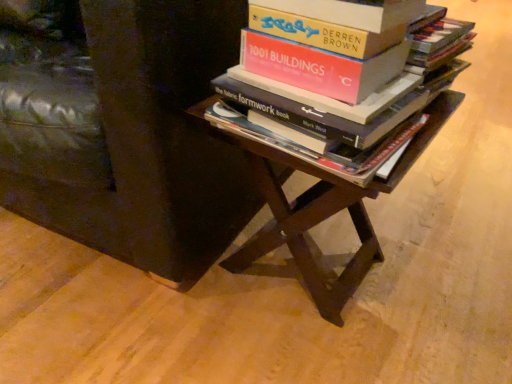
Question: Is hardcover book at center facing towards brown wooden table at center?

Choices:
 (A) yes
 (B) no

Answer: (B)

Question: Considering the relative sizes of hardcover book at center and brown wooden table at center in the image provided, is hardcover book at center smaller than brown wooden table at center?

Choices:
 (A) yes
 (B) no

Answer: (A)

Question: From the image's perspective, is hardcover book at center below brown wooden table at center?

Choices:
 (A) no
 (B) yes

Answer: (A)

Question: Does hardcover book at center lie in front of brown wooden table at center?

Choices:
 (A) yes
 (B) no

Answer: (A)

Question: Would you say hardcover book at center is a long distance from brown wooden table at center?

Choices:
 (A) yes
 (B) no

Answer: (B)

Question: Is brown wooden table at center at the back of hardcover book at center?

Choices:
 (A) no
 (B) yes

Answer: (A)

Question: Is brown wooden table at center turned away from wooden side table at center?

Choices:
 (A) no
 (B) yes

Answer: (A)

Question: Is brown wooden table at center bigger than wooden side table at center?

Choices:
 (A) no
 (B) yes

Answer: (A)

Question: Can you confirm if brown wooden table at center is thinner than wooden side table at center?

Choices:
 (A) no
 (B) yes

Answer: (B)

Question: Is brown wooden table at center positioned far away from wooden side table at center?

Choices:
 (A) yes
 (B) no

Answer: (B)

Question: Are brown wooden table at center and wooden side table at center beside each other?

Choices:
 (A) yes
 (B) no

Answer: (B)

Question: From the image's perspective, is brown wooden table at center on top of wooden side table at center?

Choices:
 (A) yes
 (B) no

Answer: (B)

Question: From a real-world perspective, is wooden side table at center on brown wooden table at center?

Choices:
 (A) yes
 (B) no

Answer: (A)